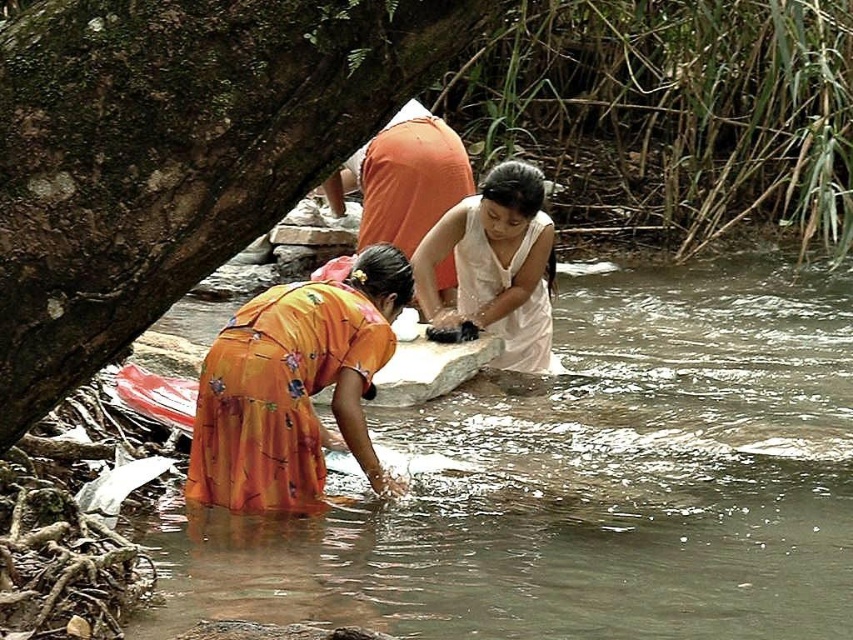
Who is taller, orange floral dress at lower left or white matte cloth at center?

white matte cloth at center

Is point (184, 488) farther from viewer compared to point (535, 186)?

No, (184, 488) is closer to viewer.

Is point (221, 461) closer to viewer compared to point (492, 268)?

Yes, point (221, 461) is in front of point (492, 268).

I want to click on orange floral dress at lower left, so click(x=294, y=387).

Is orange floral dress at lower left smaller than orange fabric at center?

Actually, orange floral dress at lower left might be larger than orange fabric at center.

Is orange floral dress at lower left further to camera compared to orange fabric at center?

No, it is in front of orange fabric at center.

Identify the location of orange floral dress at lower left. [x=294, y=387].

Find the location of a particular element. The image size is (853, 640). orange floral dress at lower left is located at coordinates (294, 387).

Who is positioned more to the left, white matte cloth at center or orange fabric at center?

orange fabric at center

Does white matte cloth at center have a larger size compared to orange fabric at center?

Indeed, white matte cloth at center has a larger size compared to orange fabric at center.

Describe the element at coordinates (496, 266) in the screenshot. I see `white matte cloth at center` at that location.

In order to click on white matte cloth at center in this screenshot , I will do (496, 266).